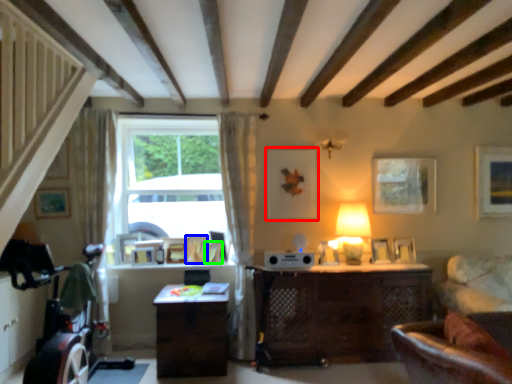
Question: Based on their relative distances, which object is farther from picture frame (highlighted by a red box)? Choose from picture frame (highlighted by a blue box) and picture frame (highlighted by a green box).

Choices:
 (A) picture frame
 (B) picture frame

Answer: (A)